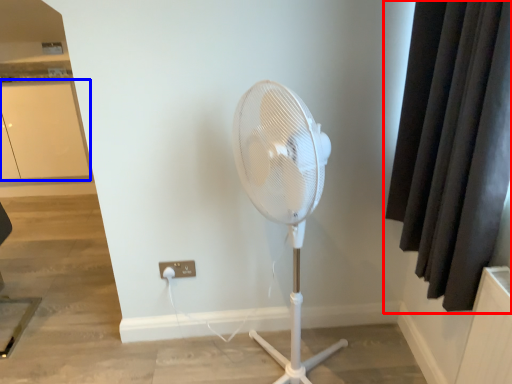
Question: Among these objects, which one is nearest to the camera, curtain (highlighted by a red box) or screen door (highlighted by a blue box)?

Choices:
 (A) curtain
 (B) screen door

Answer: (A)